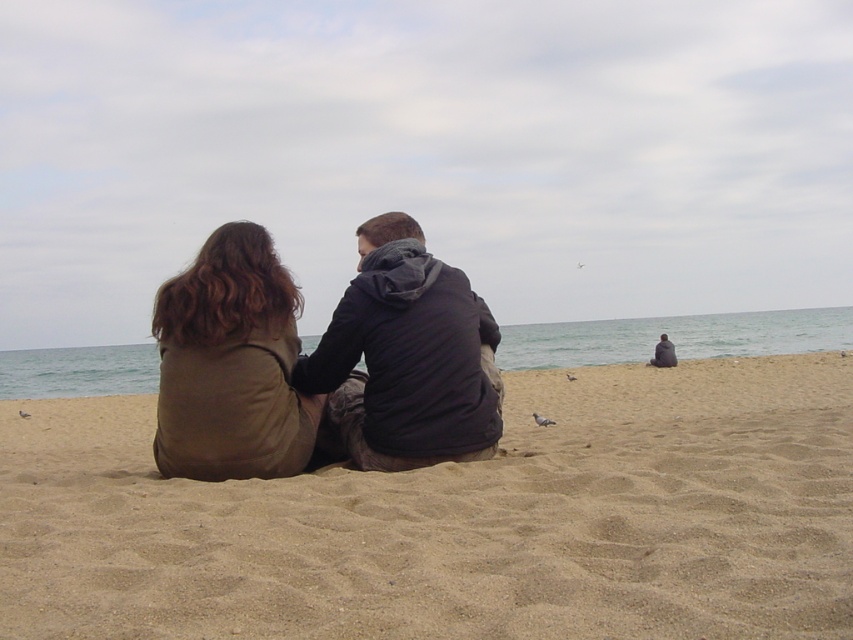
Who is positioned more to the right, brown suede jacket at center or dark gray hoodie at lower right?

dark gray hoodie at lower right

Image resolution: width=853 pixels, height=640 pixels. Identify the location of brown suede jacket at center. tap(242, 369).

Between point (45, 444) and point (21, 413), which one is positioned in front?

Point (45, 444) is more forward.

Is beige sandy beach at center bigger than brown feathered pigeon at lower left?

Correct, beige sandy beach at center is larger in size than brown feathered pigeon at lower left.

You are a GUI agent. You are given a task and a screenshot of the screen. Output one action in this format:
    pyautogui.click(x=<x>, y=<y>)
    Task: Click on the beige sandy beach at center
    This screenshot has height=640, width=853.
    Given the screenshot: What is the action you would take?
    pyautogui.click(x=457, y=518)

Locate an element on the screen. The height and width of the screenshot is (640, 853). beige sandy beach at center is located at coordinates (457, 518).

Consider the image. Is matte brown coat at center wider than gray matte pigeon at center?

Indeed, matte brown coat at center has a greater width compared to gray matte pigeon at center.

This screenshot has width=853, height=640. What do you see at coordinates (231, 364) in the screenshot? I see `matte brown coat at center` at bounding box center [231, 364].

This screenshot has width=853, height=640. Find the location of `matte brown coat at center`. matte brown coat at center is located at coordinates (231, 364).

You are a GUI agent. You are given a task and a screenshot of the screen. Output one action in this format:
    pyautogui.click(x=<x>, y=<y>)
    Task: Click on the matte brown coat at center
    The width and height of the screenshot is (853, 640).
    Given the screenshot: What is the action you would take?
    pyautogui.click(x=231, y=364)